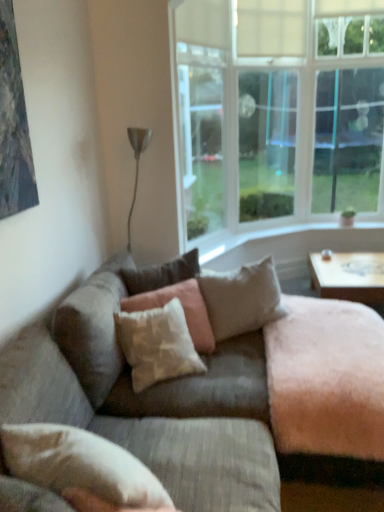
Question: From the image's perspective, is clear glass window at upper right, marked as the first window screen in a right-to-left arrangement, above or below wooden coffee table at right?

Choices:
 (A) above
 (B) below

Answer: (A)

Question: Is point (316, 162) positioned closer to the camera than point (360, 266)?

Choices:
 (A) closer
 (B) farther

Answer: (B)

Question: Which object is the farthest from the clear glass window at upper right, which is the third window screen from left to right?

Choices:
 (A) beige textured pillow at center, which is counted as the first pillow, starting from the back
 (B) wooden coffee table at right
 (C) light beige fabric pillow at center, marked as the 3th pillow in a front-to-back arrangement
 (D) textured beige couch at center
 (E) transparent plastic window screen at upper center, which ranks as the 1th window screen in left-to-right order

Answer: (D)

Question: Which is nearer to the white fabric pillow at lower left, the first pillow in the front-to-back sequence?

Choices:
 (A) textured beige couch at center
 (B) light beige fabric pillow at center, marked as the 3th pillow in a front-to-back arrangement
 (C) textured beige pillow at center, the third pillow in the back-to-front sequence
 (D) clear glass window at upper right, which is the third window screen from left to right
 (E) transparent plastic window screen at upper center, which ranks as the 1th window screen in left-to-right order

Answer: (A)